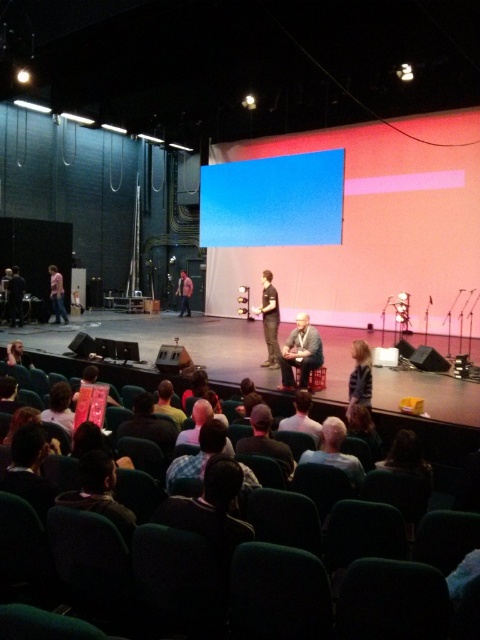
Between blue matte projection screen at center and dark brown leather jacket at lower left, which one appears on the right side from the viewer's perspective?

blue matte projection screen at center

Does blue matte projection screen at center appear under dark brown leather jacket at lower left?

Actually, blue matte projection screen at center is above dark brown leather jacket at lower left.

Between point (317, 168) and point (60, 381), which one is positioned behind?

The point (317, 168) is behind.

You are a GUI agent. You are given a task and a screenshot of the screen. Output one action in this format:
    pyautogui.click(x=<x>, y=<y>)
    Task: Click on the blue matte projection screen at center
    
    Given the screenshot: What is the action you would take?
    pyautogui.click(x=273, y=200)

Between dark brown hair at center and blonde hair at lower right, which one has less height?

With less height is dark brown hair at center.

Which is in front, point (340, 460) or point (363, 340)?

Point (340, 460)

Is point (328, 460) more distant than point (365, 385)?

No, (328, 460) is in front of (365, 385).

I want to click on dark brown hair at center, so click(335, 451).

Which is in front, point (276, 300) or point (59, 317)?

Positioned in front is point (276, 300).

Which is more to the left, dark gray pants at center or light brown leather jacket at lower left?

From the viewer's perspective, light brown leather jacket at lower left appears more on the left side.

Is point (274, 348) positioned before point (66, 321)?

Yes, it is in front of point (66, 321).

This screenshot has width=480, height=640. Identify the location of dark gray pants at center. (269, 320).